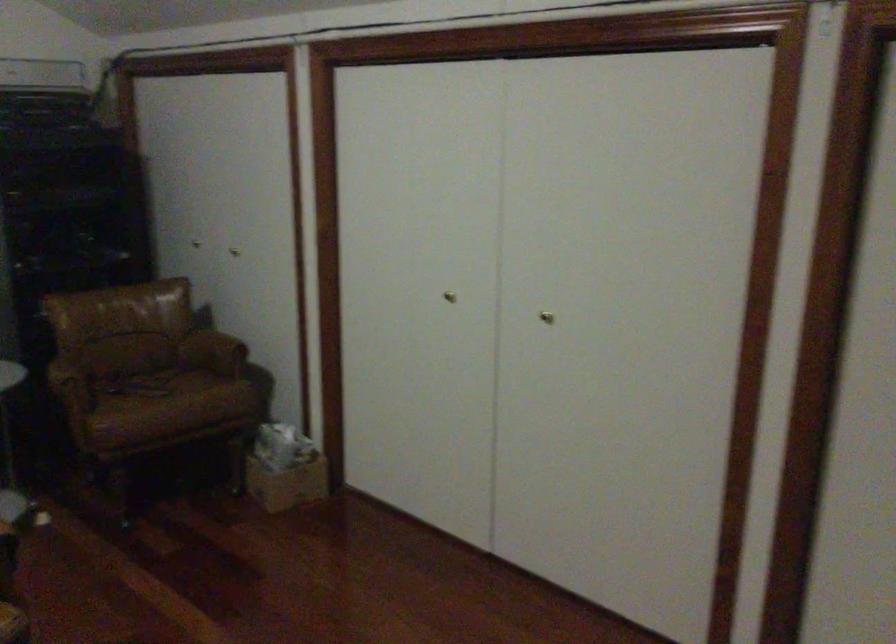
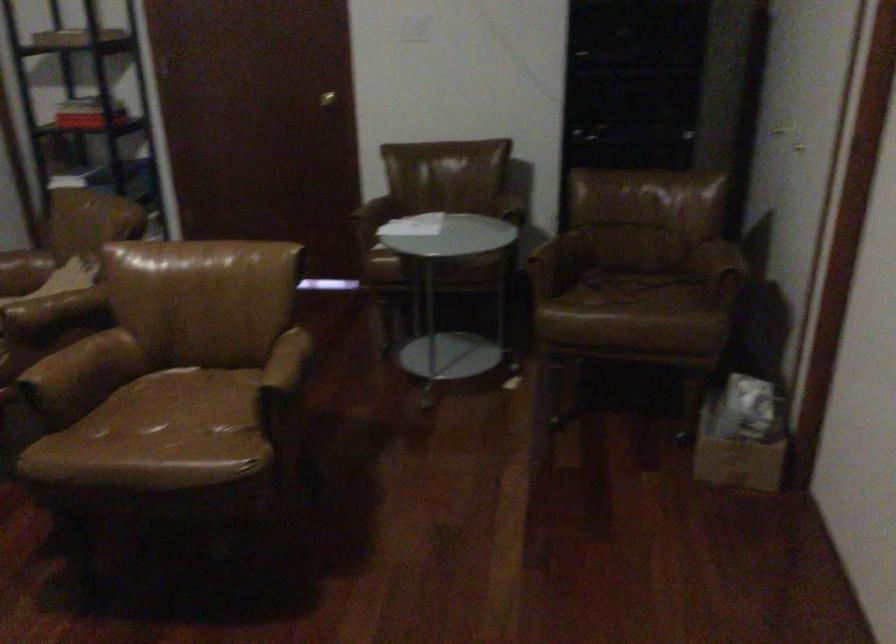
The point at (152, 382) is marked in the first image. Where is the corresponding point in the second image?

(627, 288)